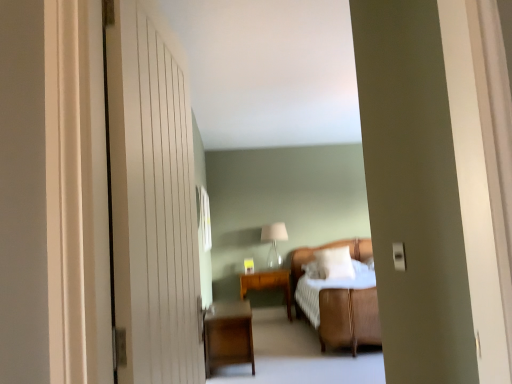
Question: Is white wooden door at left to the right of wooden side table at center from the viewer's perspective?

Choices:
 (A) yes
 (B) no

Answer: (B)

Question: Does white wooden door at left have a larger size compared to wooden side table at center?

Choices:
 (A) no
 (B) yes

Answer: (A)

Question: From a real-world perspective, is white wooden door at left beneath wooden side table at center?

Choices:
 (A) no
 (B) yes

Answer: (A)

Question: From a real-world perspective, is white wooden door at left located higher than wooden side table at center?

Choices:
 (A) yes
 (B) no

Answer: (A)

Question: Is white wooden door at left not close to wooden side table at center?

Choices:
 (A) no
 (B) yes

Answer: (B)

Question: Is white wooden door at left facing towards wooden side table at center?

Choices:
 (A) yes
 (B) no

Answer: (B)

Question: Is there a large distance between wooden side table at center and dark wood nightstand at lower left?

Choices:
 (A) no
 (B) yes

Answer: (B)

Question: Could you tell me if wooden side table at center is turned towards dark wood nightstand at lower left?

Choices:
 (A) no
 (B) yes

Answer: (B)

Question: Is wooden side table at center wider than dark wood nightstand at lower left?

Choices:
 (A) yes
 (B) no

Answer: (B)

Question: Does wooden side table at center have a larger size compared to dark wood nightstand at lower left?

Choices:
 (A) yes
 (B) no

Answer: (B)

Question: From the image's perspective, would you say wooden side table at center is positioned over dark wood nightstand at lower left?

Choices:
 (A) yes
 (B) no

Answer: (B)

Question: Is dark wood nightstand at lower left located within wooden side table at center?

Choices:
 (A) yes
 (B) no

Answer: (B)

Question: From a real-world perspective, is white soft pillow at center physically above wooden side table at center?

Choices:
 (A) no
 (B) yes

Answer: (B)